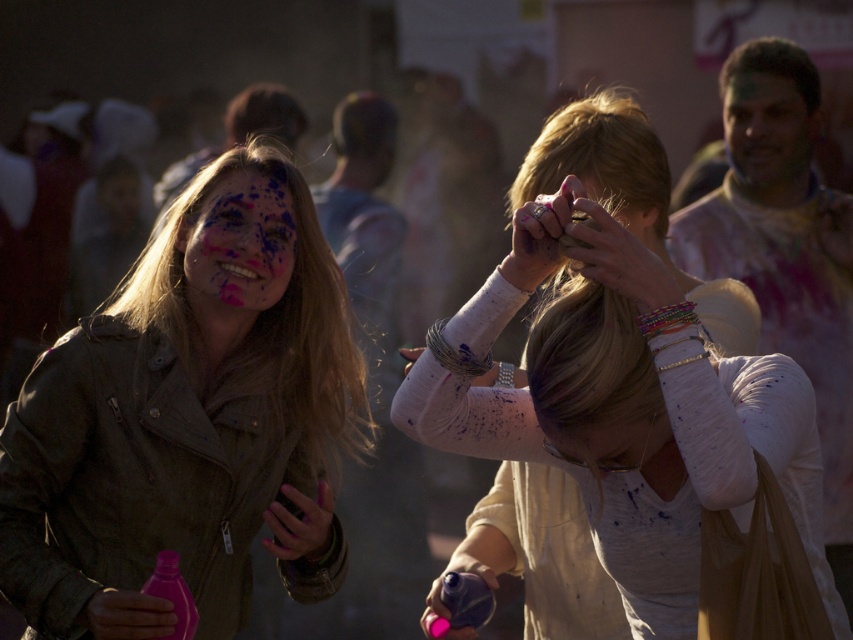
You are standing at the point marked by coordinates point (x=306, y=588) and want to throw colored powder at the person in the center. Can you reach them without moving from your current position?

The distance between you at point (x=306, y=588) and the person in the center is 12.54 feet. If your throwing range can cover 12.54 feet, then yes, you can reach them without moving.

You are a photographer at the Holi festival. You need to capture a photo of both the matte green jacket at left and the painted skin at center. Which object should you focus on first to ensure it appears larger in the photo?

The matte green jacket at left is larger in size than the painted skin at center, so you should focus on the matte green jacket at left first to ensure it appears larger in the photo.